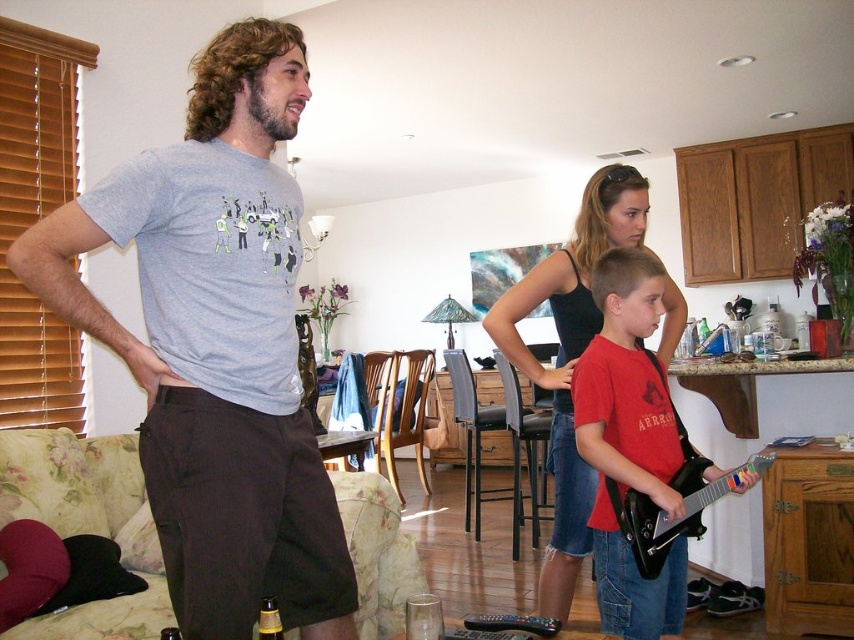
You are a photographer setting up a shoot in this living area. You need to place a narrow prop between the red matte guitar at lower right and the black tank top at center. Which object should the prop be placed closer to?

The prop should be placed closer to the red matte guitar at lower right because it is thinner than the black tank top at center, allowing more space near the guitar for the narrow prop.

You are standing in the living area and want to determine which of the two points, point (148, 237) or point (632, 228), is nearer to you. Based on the scene, which point is closer?

Point (148, 237) is closer to the viewer than point (632, 228).